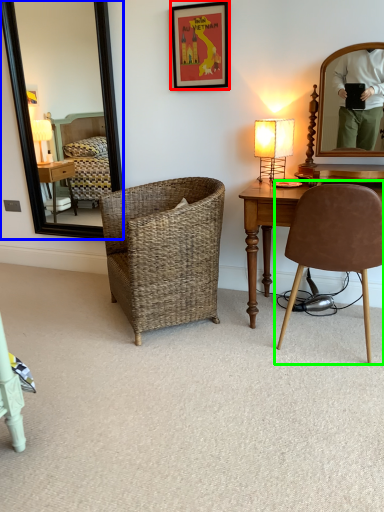
Question: Which is farther away from picture frame (highlighted by a red box)? mirror (highlighted by a blue box) or chair (highlighted by a green box)?

Choices:
 (A) mirror
 (B) chair

Answer: (A)